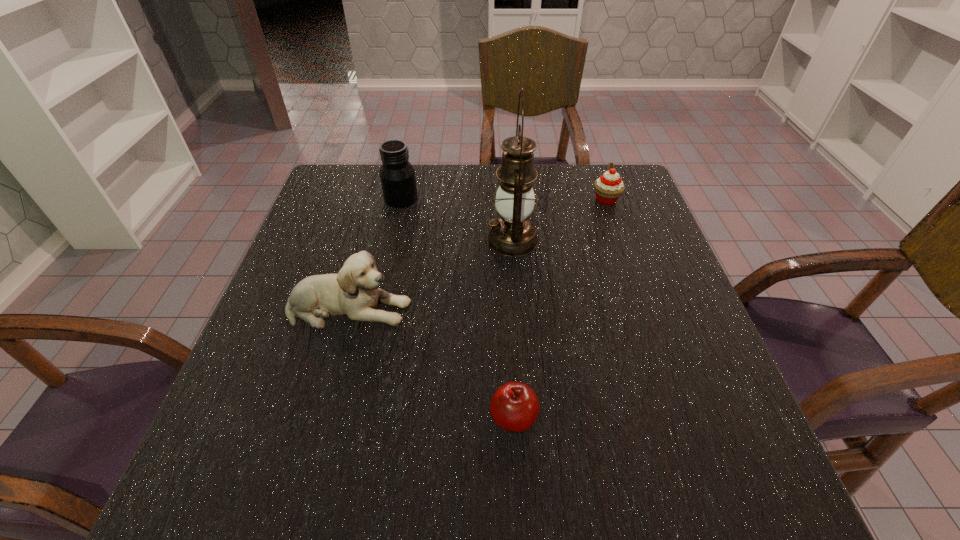
Identify the location of the third farthest object. (513, 234).

This screenshot has height=540, width=960. Identify the location of the tallest object. (513, 234).

Find the location of a particular element. The image size is (960, 540). jar is located at coordinates (397, 175).

At what (x,y) coordinates should I click in order to perform the action: click on the third tallest object. Please return your answer as a coordinate pair (x, y). The height and width of the screenshot is (540, 960). Looking at the image, I should click on (354, 292).

Locate an element on the screen. the fourth farthest object is located at coordinates (354, 292).

At what (x,y) coordinates should I click in order to perform the action: click on the rightmost object. Please return your answer as a coordinate pair (x, y). This screenshot has height=540, width=960. Looking at the image, I should click on (608, 188).

I want to click on the second shortest object, so click(608, 188).

You are a GUI agent. You are given a task and a screenshot of the screen. Output one action in this format:
    pyautogui.click(x=<x>, y=<y>)
    Task: Click on the apple
    The width and height of the screenshot is (960, 540).
    Given the screenshot: What is the action you would take?
    pyautogui.click(x=514, y=407)

At what (x,y) coordinates should I click in order to perform the action: click on the nearest object. Please return your answer as a coordinate pair (x, y). This screenshot has width=960, height=540. Looking at the image, I should click on (514, 407).

Locate an element on the screen. free region located on the left of the tallest object is located at coordinates pos(455,240).